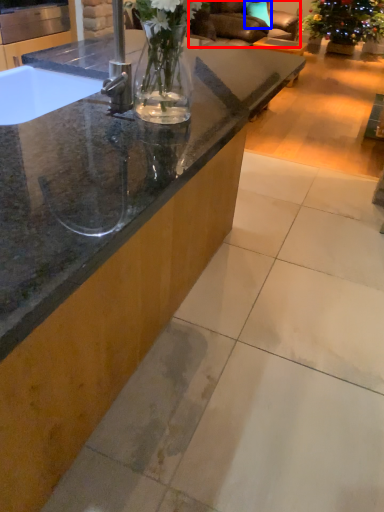
Question: Which object is closer to the camera taking this photo, armchair (highlighted by a red box) or pillow (highlighted by a blue box)?

Choices:
 (A) armchair
 (B) pillow

Answer: (A)